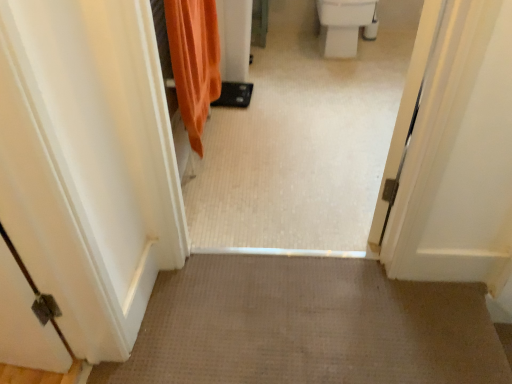
Question: Does white glossy tile floor at center have a lesser height compared to orange fabric shower curtain at upper left?

Choices:
 (A) no
 (B) yes

Answer: (A)

Question: Would you say white glossy tile floor at center is a long distance from orange fabric shower curtain at upper left?

Choices:
 (A) no
 (B) yes

Answer: (A)

Question: Is white glossy tile floor at center thinner than orange fabric shower curtain at upper left?

Choices:
 (A) no
 (B) yes

Answer: (A)

Question: Can you confirm if white glossy tile floor at center is wider than orange fabric shower curtain at upper left?

Choices:
 (A) no
 (B) yes

Answer: (B)

Question: Does white glossy tile floor at center have a greater height compared to orange fabric shower curtain at upper left?

Choices:
 (A) yes
 (B) no

Answer: (A)

Question: Can we say white glossy tile floor at center lies outside orange fabric shower curtain at upper left?

Choices:
 (A) no
 (B) yes

Answer: (B)

Question: Considering the relative positions of orange fabric shower curtain at upper left and white glossy tile floor at center in the image provided, is orange fabric shower curtain at upper left behind white glossy tile floor at center?

Choices:
 (A) yes
 (B) no

Answer: (A)

Question: From the image's perspective, is orange fabric shower curtain at upper left above white glossy tile floor at center?

Choices:
 (A) yes
 (B) no

Answer: (A)

Question: Considering the relative positions of orange fabric shower curtain at upper left and white glossy tile floor at center in the image provided, is orange fabric shower curtain at upper left to the right of white glossy tile floor at center from the viewer's perspective?

Choices:
 (A) no
 (B) yes

Answer: (A)

Question: Considering the relative sizes of orange fabric shower curtain at upper left and white glossy tile floor at center in the image provided, is orange fabric shower curtain at upper left taller than white glossy tile floor at center?

Choices:
 (A) no
 (B) yes

Answer: (A)

Question: Is orange fabric shower curtain at upper left not near white glossy tile floor at center?

Choices:
 (A) no
 (B) yes

Answer: (A)

Question: Is orange fabric shower curtain at upper left placed right next to white glossy tile floor at center?

Choices:
 (A) yes
 (B) no

Answer: (B)

Question: Is orange fabric shower curtain at upper left positioned with its back to white glossy toilet bowl at upper right?

Choices:
 (A) no
 (B) yes

Answer: (A)